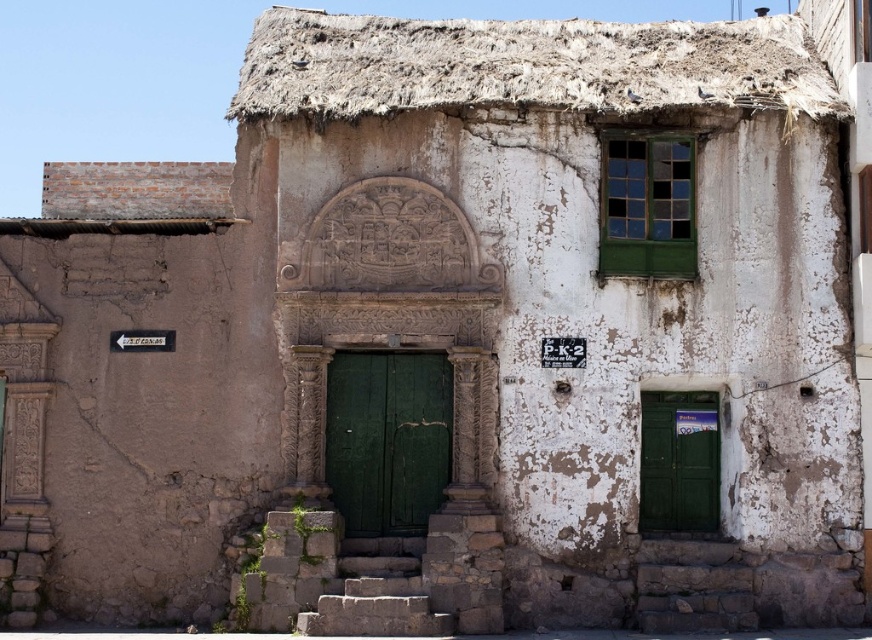
Question: Is green wooden door at center smaller than green matte door at lower right?

Choices:
 (A) yes
 (B) no

Answer: (B)

Question: Is green wooden door at center positioned at the back of green matte door at lower right?

Choices:
 (A) yes
 (B) no

Answer: (B)

Question: Can you confirm if green wooden door at center is wider than green matte door at lower right?

Choices:
 (A) yes
 (B) no

Answer: (A)

Question: Which object appears closest to the camera in this image?

Choices:
 (A) green matte door at lower right
 (B) green wooden door at center

Answer: (B)